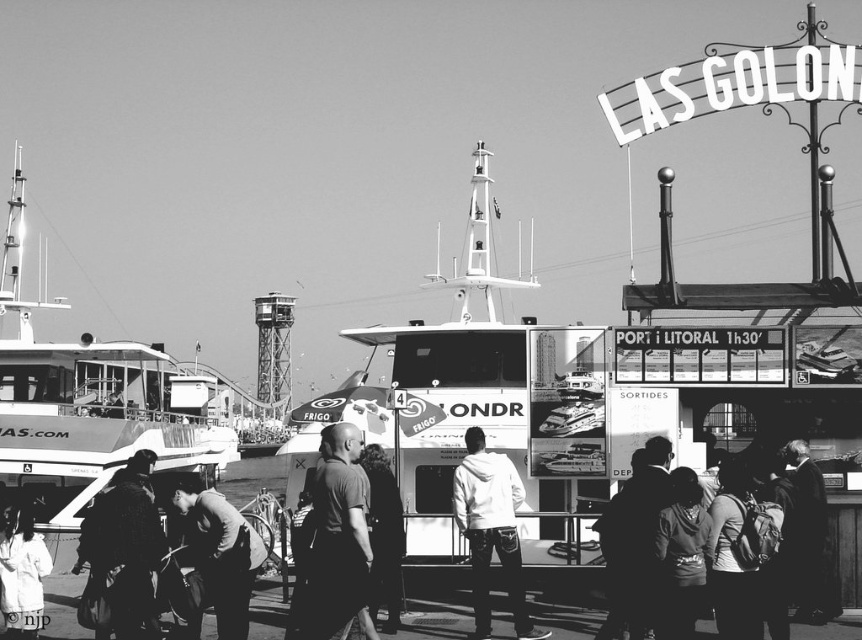
In the waterfront scene with the LAS GOLON sign, you notice two people wearing dark gray clothing. The first is wearing a dark gray shirt at center, and the second is wearing a dark gray sweater at lower center. Which person is positioned lower in the image?

The dark gray shirt at center is located below the dark gray sweater at lower center, so the person wearing the dark gray shirt at center is positioned lower in the image.

You are a photographer in the scene and want to capture the white matte hoodie at center in your shot. What coordinates should you aim for?

You should aim for the coordinates point (491, 531) to capture the white matte hoodie at center.